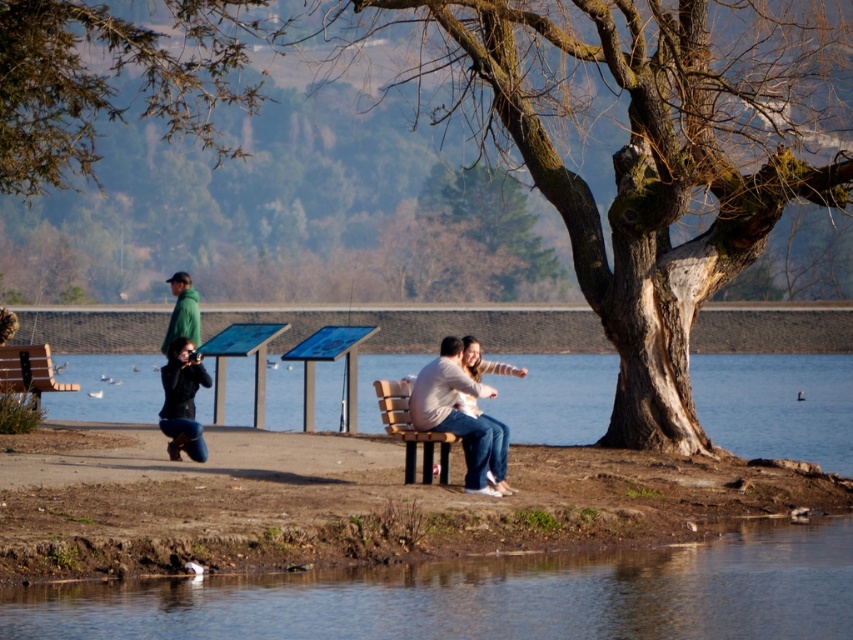
Question: Considering the real-world distances, which object is farthest from the clear blue water at bench right?

Choices:
 (A) wooden bench at center
 (B) brown rough bark tree at upper center
 (C) clear water at lower center

Answer: (A)

Question: In this image, where is smooth bark tree at center located relative to wooden bench at left?

Choices:
 (A) below
 (B) above

Answer: (B)

Question: Can you confirm if smooth bark tree at center is thinner than matte white shirt at center?

Choices:
 (A) yes
 (B) no

Answer: (B)

Question: Which of these objects is positioned closest to the wooden bench at center?

Choices:
 (A) brown rough bark tree at upper center
 (B) matte black jacket at lower left

Answer: (B)

Question: Is the position of smooth bark tree at center more distant than that of brown rough bark tree at upper center?

Choices:
 (A) yes
 (B) no

Answer: (B)

Question: Which object is closer to the camera taking this photo?

Choices:
 (A) matte black jacket at lower left
 (B) clear water at lower center
 (C) green fleece jacket at left
 (D) wooden bench at left

Answer: (B)